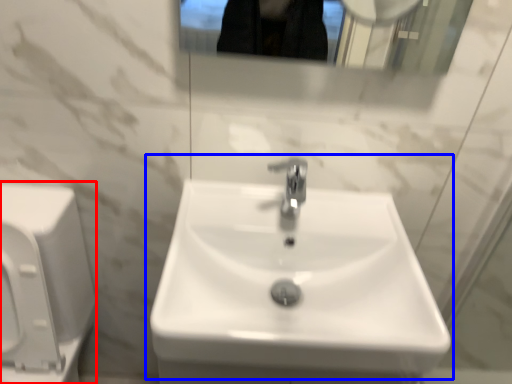
Question: Which object is further to the camera taking this photo, porcelain (highlighted by a red box) or sink (highlighted by a blue box)?

Choices:
 (A) porcelain
 (B) sink

Answer: (B)